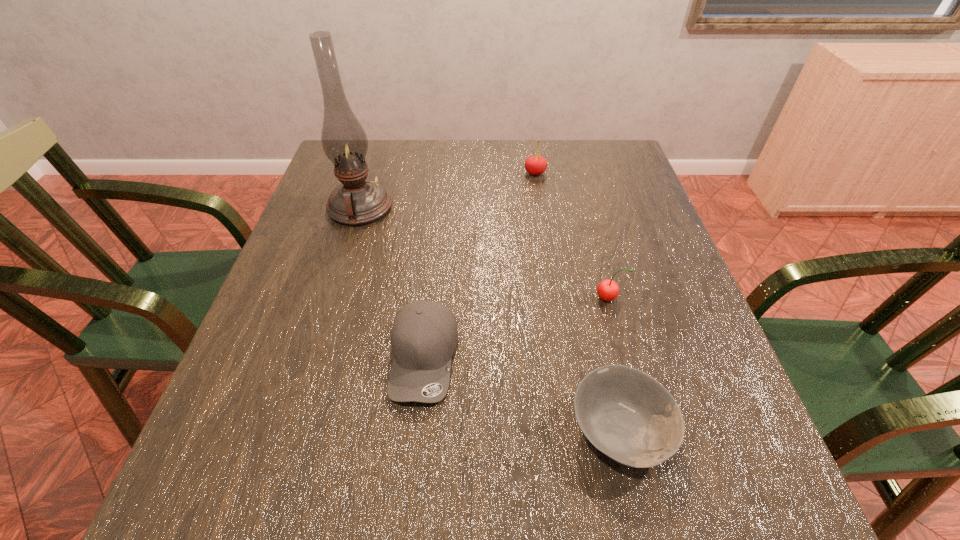
The width and height of the screenshot is (960, 540). In order to click on free spot at the near edge of the desktop in this screenshot , I will do `click(448, 508)`.

Find the location of a particular element. Image resolution: width=960 pixels, height=540 pixels. free space at the left edge of the desktop is located at coordinates (275, 411).

Identify the location of vacant region at the right edge of the desktop. (646, 285).

This screenshot has width=960, height=540. Find the location of `vacant space at the far left corner of the desktop`. vacant space at the far left corner of the desktop is located at coordinates (376, 145).

The width and height of the screenshot is (960, 540). I want to click on free space at the near left corner of the desktop, so click(251, 469).

Image resolution: width=960 pixels, height=540 pixels. Find the location of `vacant region at the far right corner of the desktop`. vacant region at the far right corner of the desktop is located at coordinates (596, 153).

Locate an element on the screen. The image size is (960, 540). blank space at the near right corner of the desktop is located at coordinates (755, 518).

This screenshot has width=960, height=540. Identify the location of unoccupied position between the shortest object and the farther cherry. (578, 301).

Where is `empty location between the baseball cap and the third farthest object`? Image resolution: width=960 pixels, height=540 pixels. empty location between the baseball cap and the third farthest object is located at coordinates [516, 328].

Identify the location of vacant space that is in between the leftmost object and the nearer cherry. (484, 253).